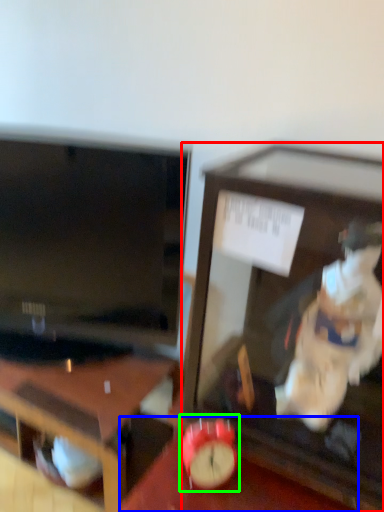
Question: Based on their relative distances, which object is nearer to furniture (highlighted by a red box)? Choose from table (highlighted by a blue box) and alarm clock (highlighted by a green box).

Choices:
 (A) table
 (B) alarm clock

Answer: (A)